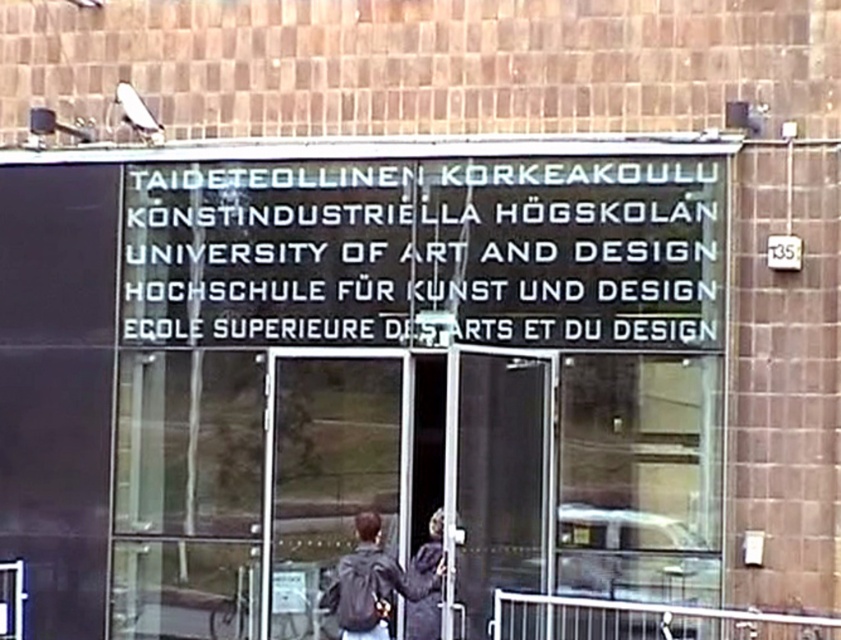
Question: Which object is positioned closest to the white plastic sign at center?

Choices:
 (A) matte black jacket at center
 (B) black glass sign at center

Answer: (B)

Question: Based on their relative distances, which object is nearer to the dark gray jacket at center?

Choices:
 (A) black glass sign at center
 (B) white plastic sign at center

Answer: (B)

Question: Which of the following is the closest to the observer?

Choices:
 (A) dark gray jacket at center
 (B) white plastic sign at center
 (C) matte black jacket at center

Answer: (C)

Question: Does matte black jacket at center appear over dark gray jacket at center?

Choices:
 (A) no
 (B) yes

Answer: (B)

Question: Is black glass sign at center closer to the viewer compared to dark gray jacket at center?

Choices:
 (A) yes
 (B) no

Answer: (B)

Question: Does matte black jacket at center have a lesser width compared to dark gray jacket at center?

Choices:
 (A) yes
 (B) no

Answer: (B)